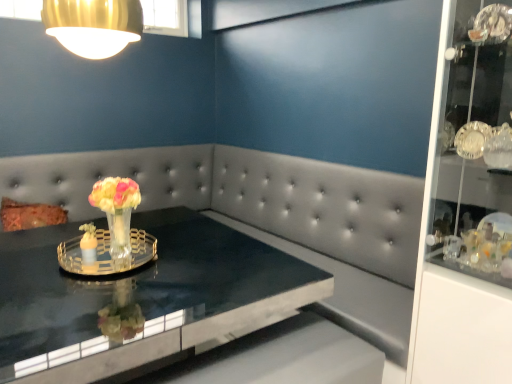
Question: Can you confirm if gold metallic lampshade at upper left is shorter than black glossy table at center?

Choices:
 (A) no
 (B) yes

Answer: (B)

Question: Is gold metallic lampshade at upper left in front of black glossy table at center?

Choices:
 (A) no
 (B) yes

Answer: (A)

Question: Does gold metallic lampshade at upper left have a lesser width compared to black glossy table at center?

Choices:
 (A) no
 (B) yes

Answer: (B)

Question: Is gold metallic lampshade at upper left turned away from black glossy table at center?

Choices:
 (A) no
 (B) yes

Answer: (A)

Question: From a real-world perspective, is gold metallic lampshade at upper left positioned under black glossy table at center based on gravity?

Choices:
 (A) no
 (B) yes

Answer: (A)

Question: Considering the positions of point (67, 0) and point (202, 289), is point (67, 0) closer or farther from the camera than point (202, 289)?

Choices:
 (A) farther
 (B) closer

Answer: (B)

Question: Is gold metallic lampshade at upper left to the left or to the right of black glossy table at center in the image?

Choices:
 (A) right
 (B) left

Answer: (B)

Question: In terms of height, does gold metallic lampshade at upper left look taller or shorter compared to black glossy table at center?

Choices:
 (A) tall
 (B) short

Answer: (B)

Question: Would you say gold metallic lampshade at upper left is inside or outside black glossy table at center?

Choices:
 (A) inside
 (B) outside

Answer: (B)

Question: Based on their sizes in the image, would you say gold metallic lampshade at upper left is bigger or smaller than translucent glass vase at center?

Choices:
 (A) big
 (B) small

Answer: (A)

Question: In terms of height, does gold metallic lampshade at upper left look taller or shorter compared to translucent glass vase at center?

Choices:
 (A) tall
 (B) short

Answer: (B)

Question: In terms of width, does gold metallic lampshade at upper left look wider or thinner when compared to translucent glass vase at center?

Choices:
 (A) wide
 (B) thin

Answer: (A)

Question: Based on their positions, is gold metallic lampshade at upper left located to the left or right of translucent glass vase at center?

Choices:
 (A) right
 (B) left

Answer: (B)

Question: Considering the positions of point [100, 18] and point [66, 248], is point [100, 18] closer or farther from the camera than point [66, 248]?

Choices:
 (A) farther
 (B) closer

Answer: (B)

Question: In terms of width, does gold metallic lampshade at upper left look wider or thinner when compared to clear glass tray at center?

Choices:
 (A) thin
 (B) wide

Answer: (A)